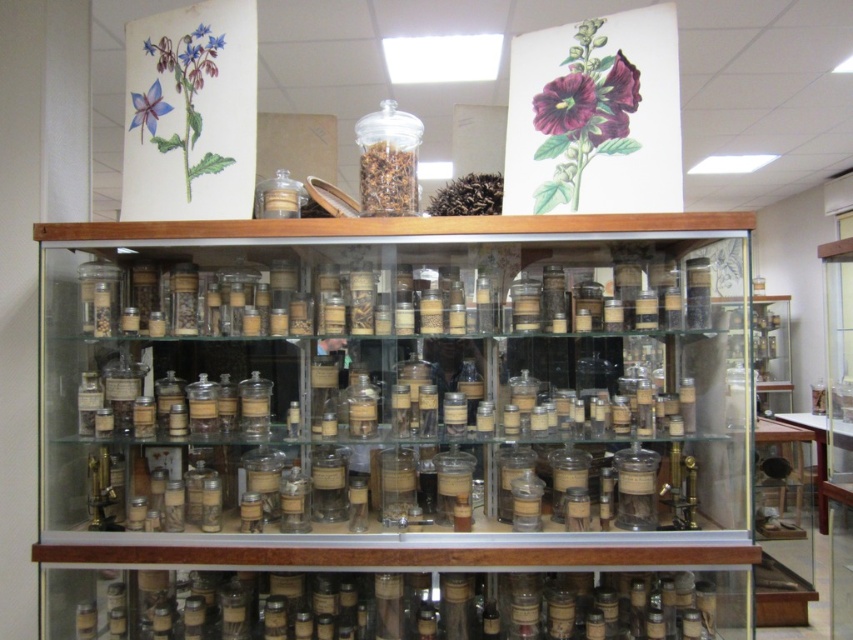
This screenshot has height=640, width=853. Describe the element at coordinates (397, 428) in the screenshot. I see `clear glass jars at center` at that location.

Between clear glass jars at center and transparent glass jar at center, which one is positioned lower?

Positioned lower is clear glass jars at center.

Is point (251, 326) behind point (383, 198)?

No.

Locate an element on the screen. The width and height of the screenshot is (853, 640). clear glass jars at center is located at coordinates (397, 428).